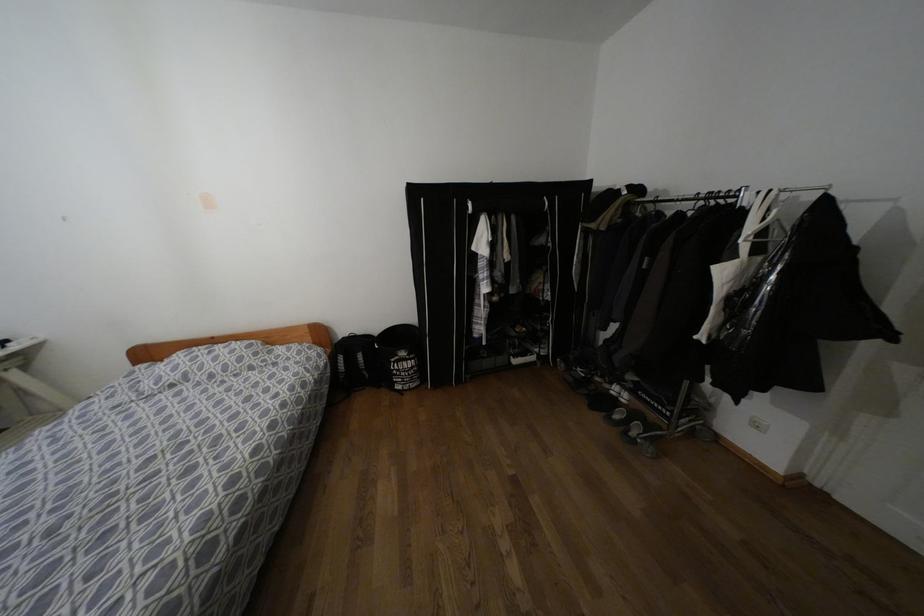
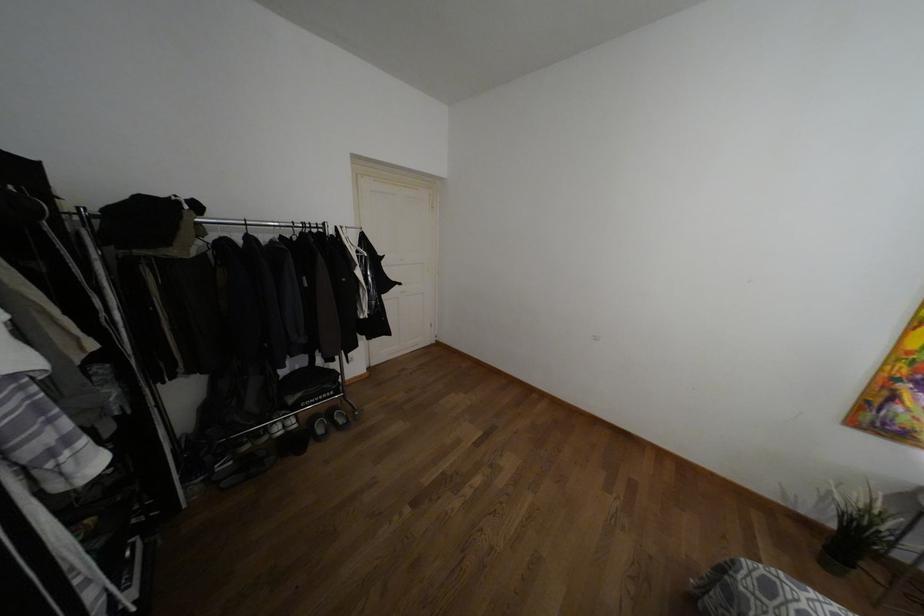
Where in the second image is the point corresponding to [597,379] from the first image?

(246, 447)